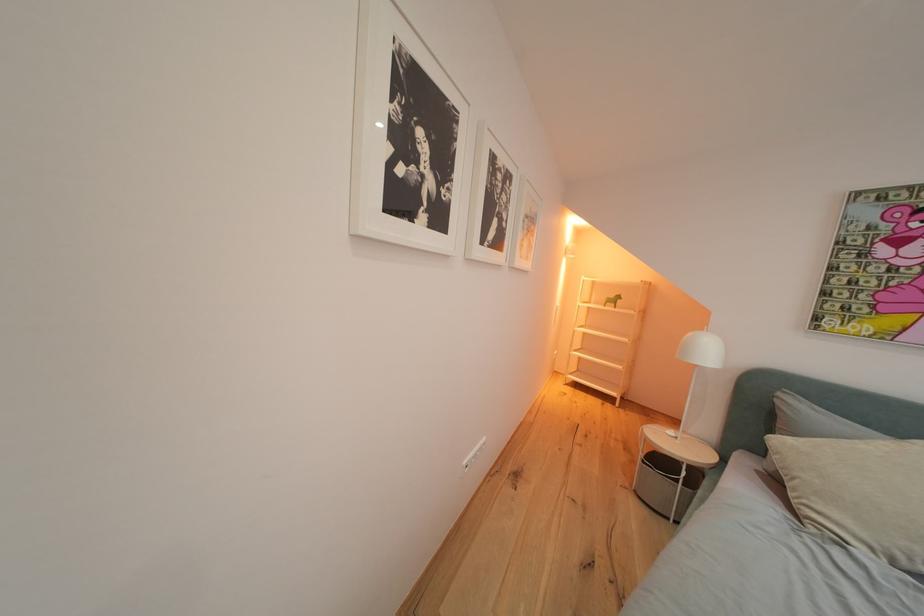
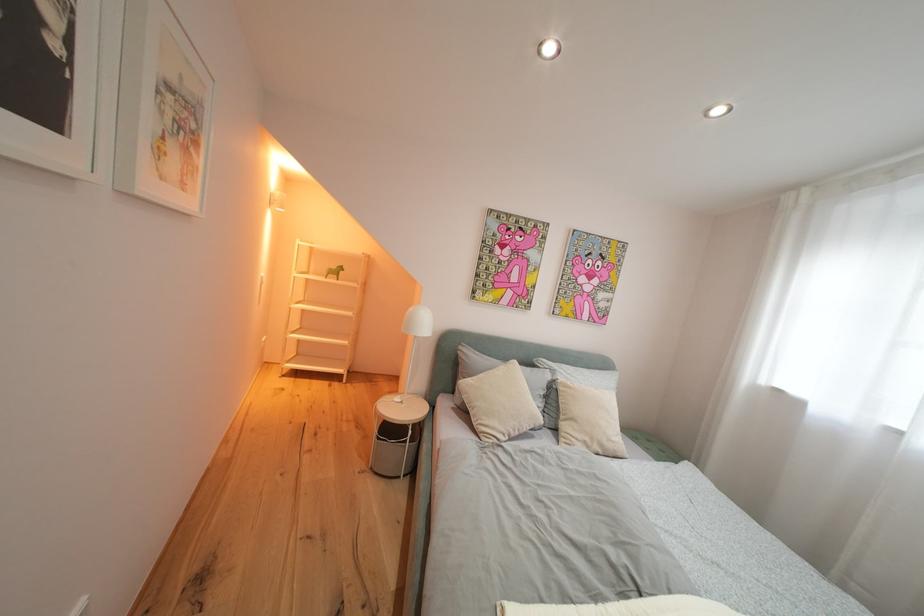
Question: How did the camera likely rotate?

Choices:
 (A) Left
 (B) Right
 (C) Up
 (D) Down

Answer: (B)